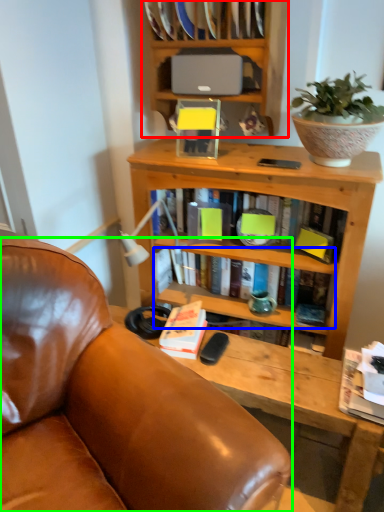
Question: Estimate the real-world distances between objects in this image. Which object is closer to bookcase (highlighted by a red box), book (highlighted by a blue box) or chair (highlighted by a green box)?

Choices:
 (A) book
 (B) chair

Answer: (A)